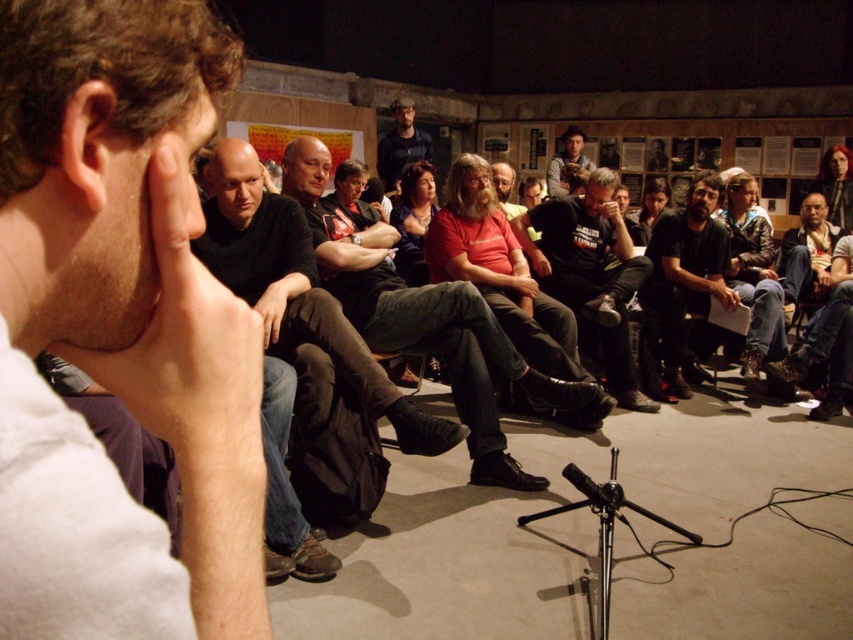
Does red shirt at center have a lesser height compared to matte black jacket at upper right?

No.

Between point (583, 205) and point (850, 221), which one is positioned in front?

Point (583, 205) is more forward.

Who is more distant from viewer, (583, 275) or (851, 198)?

Point (851, 198)

Where is `red shirt at center`? The width and height of the screenshot is (853, 640). red shirt at center is located at coordinates (590, 273).

Between matte black shirt at center and black metallic microphone at center, which one is positioned lower?

black metallic microphone at center

Can you confirm if matte black shirt at center is taller than black metallic microphone at center?

Yes, matte black shirt at center is taller than black metallic microphone at center.

Image resolution: width=853 pixels, height=640 pixels. Describe the element at coordinates (566, 161) in the screenshot. I see `matte black shirt at center` at that location.

Locate an element on the screen. The height and width of the screenshot is (640, 853). matte black shirt at center is located at coordinates click(566, 161).

Can you confirm if red matte shirt at center is positioned below matte black shirt at center?

Yes, red matte shirt at center is below matte black shirt at center.

Locate an element on the screen. This screenshot has width=853, height=640. red matte shirt at center is located at coordinates (427, 321).

Find the location of `red matte shirt at center`. red matte shirt at center is located at coordinates pos(427,321).